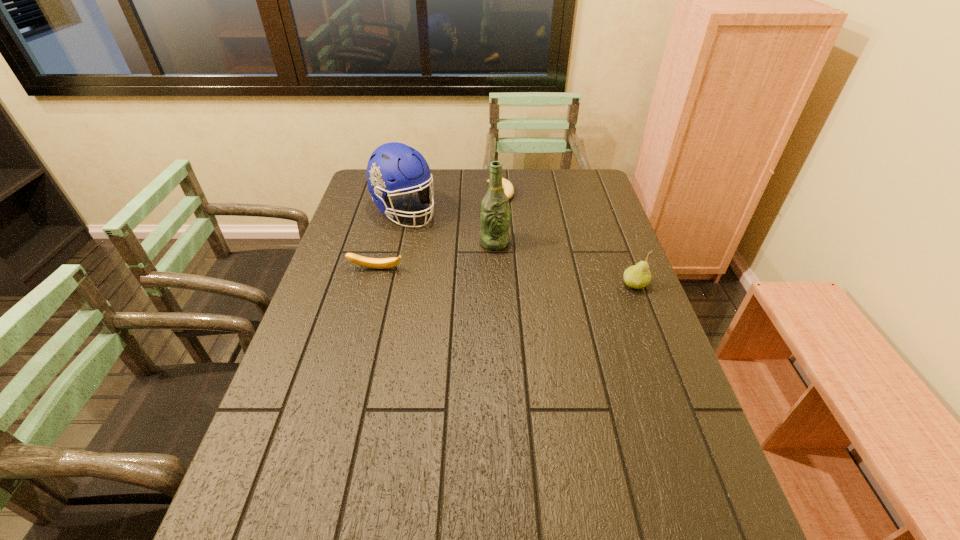
The height and width of the screenshot is (540, 960). Identify the location of vacant space on the desktop that is between the left banana and the nearest object and is positioned on the face guard of the fourth shortest object. (483, 275).

You are a GUI agent. You are given a task and a screenshot of the screen. Output one action in this format:
    pyautogui.click(x=<x>, y=<y>)
    Task: Click on the free spot on the desktop that is between the second shortest object and the pear and is positioned on the surface of the third nearest object
    
    Given the screenshot: What is the action you would take?
    pyautogui.click(x=534, y=279)

Identify the location of free spot on the desktop that is between the fourth tallest object and the pear and is positioned at the stem of the shortest object. This screenshot has height=540, width=960. (540, 279).